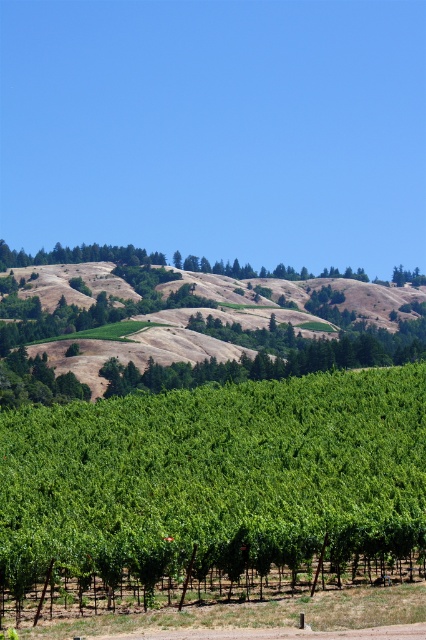
Between green leafy tree at center and brown textured hillside at upper center, which one has less height?

With less height is green leafy tree at center.

Image resolution: width=426 pixels, height=640 pixels. What do you see at coordinates (215, 477) in the screenshot? I see `green leafy tree at center` at bounding box center [215, 477].

Is point (201, 566) in front of point (152, 365)?

Yes, it is.

Locate an element on the screen. The height and width of the screenshot is (640, 426). green leafy tree at center is located at coordinates (215, 477).